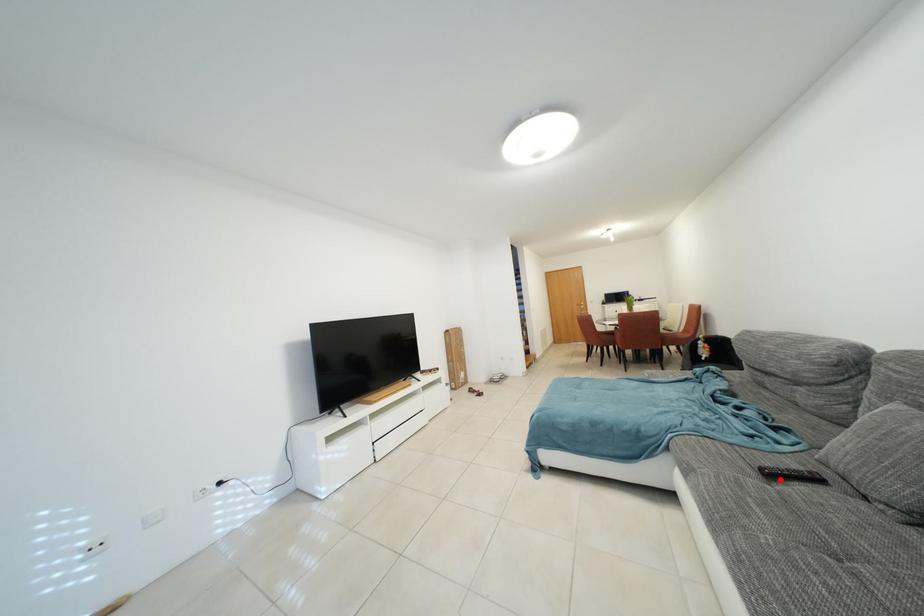
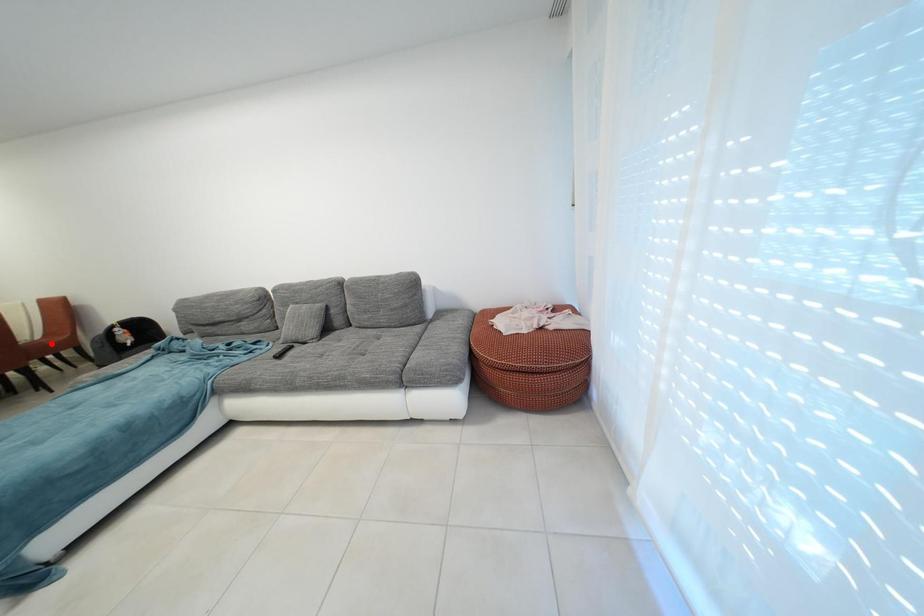
I am providing you with two images of the same scene from different viewpoints. A red point is marked on the first image and another point is marked on the second image. Is the red point in image1 aligned with the point shown in image2?

No